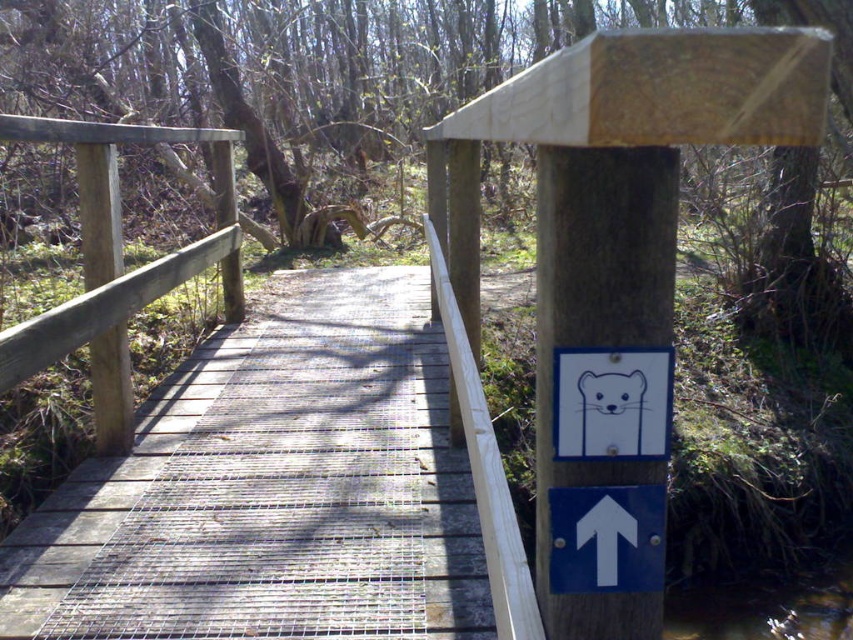
Can you confirm if wooden bridge at center is positioned to the right of white plastic arrow at upper center?

Incorrect, wooden bridge at center is not on the right side of white plastic arrow at upper center.

Locate an element on the screen. This screenshot has width=853, height=640. wooden bridge at center is located at coordinates (271, 488).

Does wooden bridge at center have a lesser width compared to natural wood signpost at upper center?

No.

In the scene shown: Who is taller, wooden bridge at center or natural wood signpost at upper center?

natural wood signpost at upper center

Locate an element on the screen. This screenshot has height=640, width=853. wooden bridge at center is located at coordinates (271, 488).

Does point (828, 35) lie in front of point (566, 540)?

Yes.

Between point (454, 244) and point (583, 561), which one is positioned in front?

Point (583, 561) is more forward.

Which is in front, point (601, 324) or point (554, 576)?

Positioned in front is point (601, 324).

At what (x,y) coordinates should I click in order to perform the action: click on natural wood signpost at upper center. Please return your answer as a coordinate pair (x, y). This screenshot has width=853, height=640. Looking at the image, I should click on (611, 221).